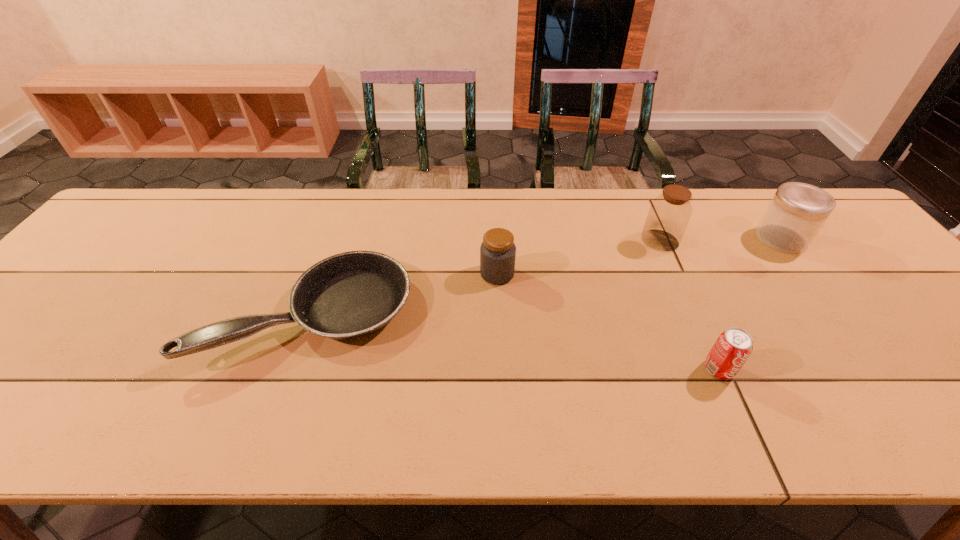
The height and width of the screenshot is (540, 960). Find the location of `vacant area situated 0.200m on the surface of the nearest jar near the warning symbol`. vacant area situated 0.200m on the surface of the nearest jar near the warning symbol is located at coordinates (404, 274).

The image size is (960, 540). What are the coordinates of `vacant space located on the surface of the nearest jar near the warning symbol` in the screenshot? It's located at (400, 274).

Locate an element on the screen. free space located on the left of the soda is located at coordinates (532, 369).

This screenshot has width=960, height=540. I want to click on vacant region located on the back of the leftmost object, so click(x=345, y=217).

This screenshot has height=540, width=960. What are the coordinates of `object located in the right edge section of the desktop` in the screenshot? It's located at (797, 212).

Identify the location of object present at the far right corner. (797, 212).

Where is `free space at the far edge of the desktop`? This screenshot has height=540, width=960. free space at the far edge of the desktop is located at coordinates (319, 208).

You are a GUI agent. You are given a task and a screenshot of the screen. Output one action in this format:
    pyautogui.click(x=<x>, y=<y>)
    Task: Click on the vacant space at the near edge
    
    Given the screenshot: What is the action you would take?
    pyautogui.click(x=181, y=438)

The width and height of the screenshot is (960, 540). What are the coordinates of `vacant space at the left edge of the desktop` in the screenshot? It's located at (39, 321).

Image resolution: width=960 pixels, height=540 pixels. In order to click on vacant region at the right edge of the desktop in this screenshot , I will do `click(956, 353)`.